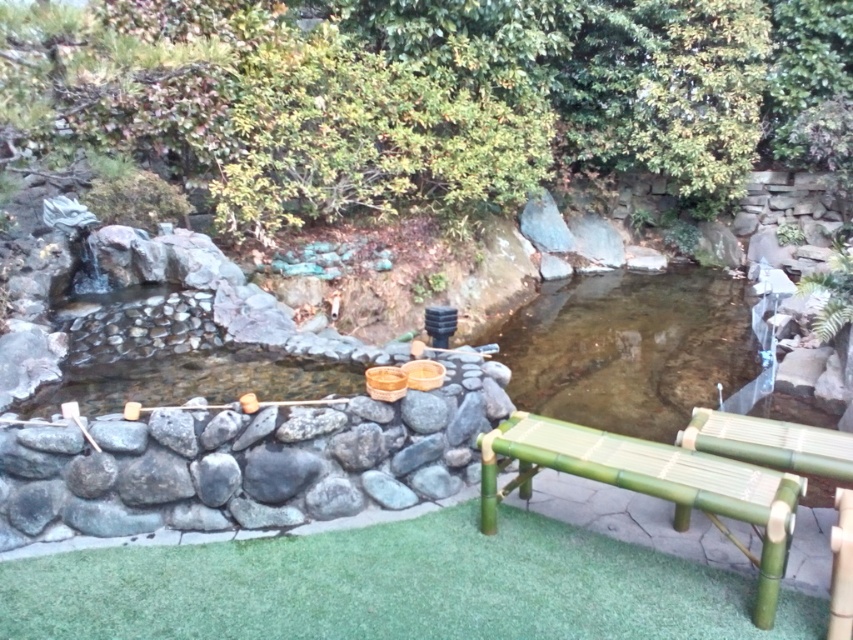
Who is taller, clear water at center or green bamboo bench at lower right?

clear water at center is taller.

Is clear water at center closer to camera compared to green bamboo bench at lower right?

No, clear water at center is further to the viewer.

Is point (669, 419) positioned behind point (751, 492)?

Yes, point (669, 419) is behind point (751, 492).

In order to click on clear water at center in this screenshot , I will do `click(631, 348)`.